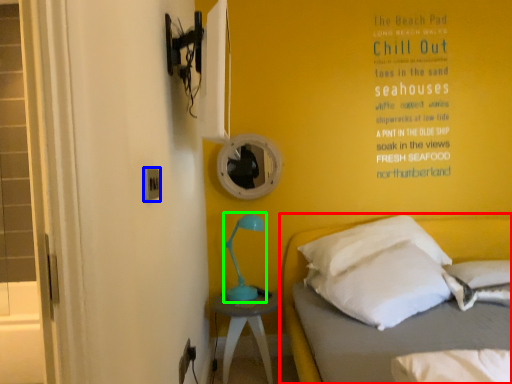
Question: Which is farther away from bed (highlighted by a red box)? electric outlet (highlighted by a blue box) or table lamp (highlighted by a green box)?

Choices:
 (A) electric outlet
 (B) table lamp

Answer: (A)